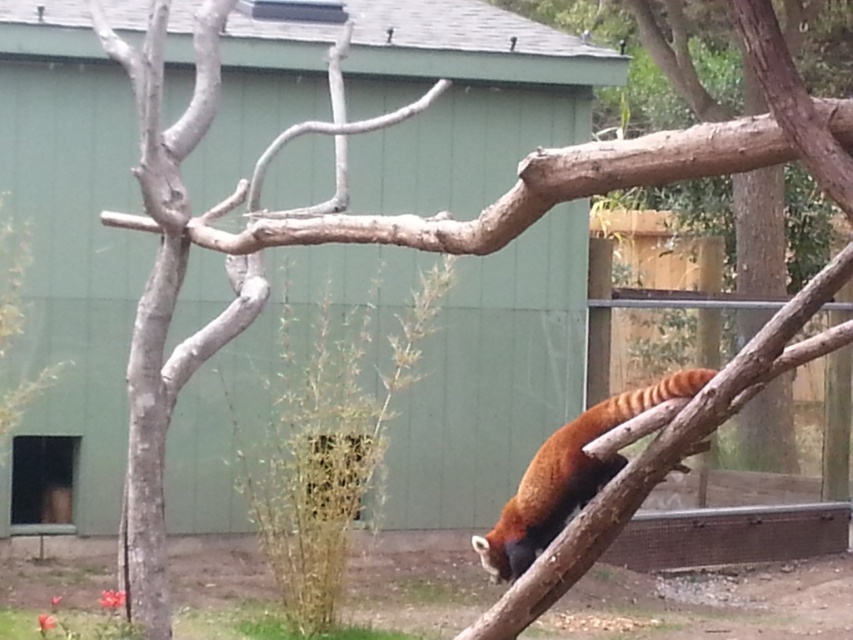
Question: Is smooth gray tree trunk at left to the left of orange-brown fur at center from the viewer's perspective?

Choices:
 (A) no
 (B) yes

Answer: (B)

Question: Is smooth gray tree trunk at left above orange-brown fur at center?

Choices:
 (A) no
 (B) yes

Answer: (B)

Question: Which object is closer to the camera taking this photo?

Choices:
 (A) orange-brown fur at center
 (B) smooth gray tree trunk at left

Answer: (A)

Question: Which object appears farthest from the camera in this image?

Choices:
 (A) orange-brown fur at center
 (B) smooth gray tree trunk at left

Answer: (B)

Question: Among these objects, which one is nearest to the camera?

Choices:
 (A) smooth gray tree trunk at left
 (B) orange-brown fur at center

Answer: (B)

Question: Is smooth gray tree trunk at left above orange-brown fur at center?

Choices:
 (A) no
 (B) yes

Answer: (B)